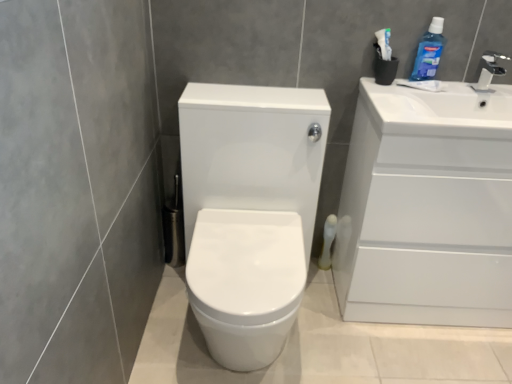
Question: From the image's perspective, is white glossy cabinet at right above white matte toilet paper at lower right?

Choices:
 (A) yes
 (B) no

Answer: (A)

Question: Is white glossy cabinet at right to the left of white matte toilet paper at lower right from the viewer's perspective?

Choices:
 (A) no
 (B) yes

Answer: (A)

Question: Can you confirm if white glossy cabinet at right is positioned to the right of white matte toilet paper at lower right?

Choices:
 (A) no
 (B) yes

Answer: (B)

Question: Considering the relative sizes of white glossy cabinet at right and white matte toilet paper at lower right in the image provided, is white glossy cabinet at right thinner than white matte toilet paper at lower right?

Choices:
 (A) yes
 (B) no

Answer: (B)

Question: Would you say white glossy cabinet at right contains white matte toilet paper at lower right?

Choices:
 (A) yes
 (B) no

Answer: (B)

Question: Can you confirm if white glossy cabinet at right is bigger than white matte toilet paper at lower right?

Choices:
 (A) no
 (B) yes

Answer: (B)

Question: From the image's perspective, would you say blue glossy mouthwash at upper right is shown under white glossy toilet at center?

Choices:
 (A) no
 (B) yes

Answer: (A)

Question: Does blue glossy mouthwash at upper right have a lesser height compared to white glossy toilet at center?

Choices:
 (A) no
 (B) yes

Answer: (B)

Question: Is blue glossy mouthwash at upper right turned away from white glossy toilet at center?

Choices:
 (A) yes
 (B) no

Answer: (B)

Question: Is blue glossy mouthwash at upper right in contact with white glossy toilet at center?

Choices:
 (A) no
 (B) yes

Answer: (A)

Question: Is white glossy toilet at center inside blue glossy mouthwash at upper right?

Choices:
 (A) no
 (B) yes

Answer: (A)

Question: Is blue glossy mouthwash at upper right further to camera compared to white glossy toilet at center?

Choices:
 (A) yes
 (B) no

Answer: (A)

Question: From the image's perspective, is white glossy cabinet at right above white glossy faucet at upper right?

Choices:
 (A) yes
 (B) no

Answer: (B)